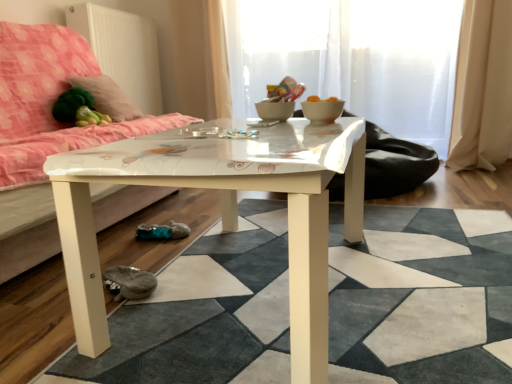
Question: From the image's perspective, is transparent glass door at upper center, the 2th glass door positioned from the front, on top of fluffy pink pillow at upper left?

Choices:
 (A) no
 (B) yes

Answer: (B)

Question: From the image's perspective, is transparent glass door at upper center, which appears as the 1th glass door when viewed from the back, located beneath fluffy pink pillow at upper left?

Choices:
 (A) no
 (B) yes

Answer: (A)

Question: Is the depth of transparent glass door at upper center, which appears as the 1th glass door when viewed from the back, greater than that of fluffy pink pillow at upper left?

Choices:
 (A) no
 (B) yes

Answer: (B)

Question: Does transparent glass door at upper center, which appears as the 1th glass door when viewed from the back, turn towards fluffy pink pillow at upper left?

Choices:
 (A) no
 (B) yes

Answer: (A)

Question: Is transparent glass door at upper center, the 2th glass door positioned from the front, beside fluffy pink pillow at upper left?

Choices:
 (A) yes
 (B) no

Answer: (B)

Question: From the image's perspective, is white glossy table at center above or below white glossy bowl at center?

Choices:
 (A) above
 (B) below

Answer: (B)

Question: Is point pyautogui.click(x=499, y=264) positioned closer to the camera than point pyautogui.click(x=337, y=112)?

Choices:
 (A) closer
 (B) farther

Answer: (A)

Question: In terms of width, does white glossy table at center look wider or thinner when compared to white glossy bowl at center?

Choices:
 (A) wide
 (B) thin

Answer: (A)

Question: From a real-world perspective, relative to white glossy bowl at center, is white glossy table at center vertically above or below?

Choices:
 (A) below
 (B) above

Answer: (A)

Question: In terms of width, does beige fabric curtain at right look wider or thinner when compared to white glossy coffee table at center?

Choices:
 (A) wide
 (B) thin

Answer: (B)

Question: From a real-world perspective, is beige fabric curtain at right above or below white glossy coffee table at center?

Choices:
 (A) below
 (B) above

Answer: (B)

Question: In the image, is beige fabric curtain at right positioned in front of or behind white glossy coffee table at center?

Choices:
 (A) behind
 (B) front

Answer: (A)

Question: Considering the relative positions of beige fabric curtain at right and white glossy coffee table at center in the image provided, is beige fabric curtain at right to the left or to the right of white glossy coffee table at center?

Choices:
 (A) left
 (B) right

Answer: (B)

Question: Is transparent glass door at center, which is the first glass door in front-to-back order, inside the boundaries of white glossy bowl at center, or outside?

Choices:
 (A) inside
 (B) outside

Answer: (B)

Question: Looking at the image, does transparent glass door at center, which is the 2th glass door in back-to-front order, seem bigger or smaller compared to white glossy bowl at center?

Choices:
 (A) small
 (B) big

Answer: (B)